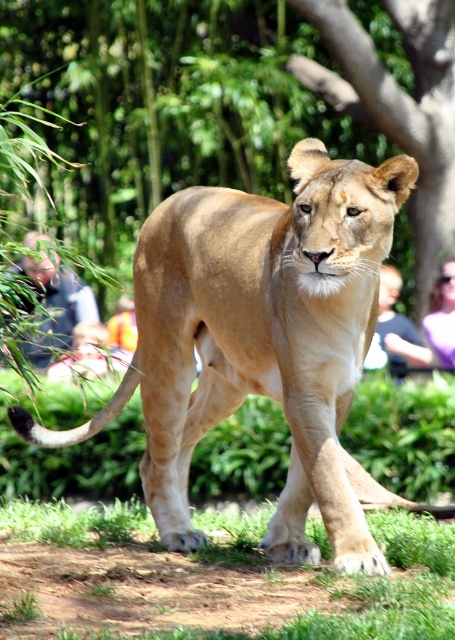
Question: Which is farther from the blurred sunglasses at upper center?

Choices:
 (A) golden fur lion at center
 (B) dark blue shirt at left

Answer: (A)

Question: Estimate the real-world distances between objects in this image. Which object is farther from the blurred sunglasses at upper center?

Choices:
 (A) smooth skin person at right
 (B) brown textured tree at center
 (C) green leafy tree at center

Answer: (C)

Question: Which object appears closest to the camera in this image?

Choices:
 (A) smooth skin person at right
 (B) brown textured tree at center

Answer: (A)

Question: Is golden fur lion at center to the right of dark blue shirt at left from the viewer's perspective?

Choices:
 (A) yes
 (B) no

Answer: (A)

Question: Does green leafy tree at center have a smaller size compared to brown textured tree at center?

Choices:
 (A) yes
 (B) no

Answer: (B)

Question: Does green leafy tree at center appear on the right side of smooth skin person at right?

Choices:
 (A) no
 (B) yes

Answer: (A)